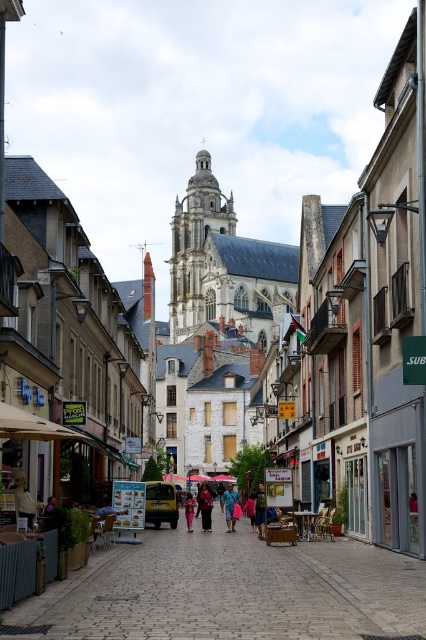
How far apart are black fabric bag at center and white fabric umbrella at center?

black fabric bag at center is 12.96 meters from white fabric umbrella at center.

Between black fabric bag at center and white fabric umbrella at center, which one is positioned higher?

Positioned higher is black fabric bag at center.

Describe the element at coordinates (204, 506) in the screenshot. I see `black fabric bag at center` at that location.

The height and width of the screenshot is (640, 426). Identify the location of black fabric bag at center. (204, 506).

Is point (206, 490) farther from viewer compared to point (187, 513)?

Yes, it is behind point (187, 513).

Can you confirm if black fabric bag at center is bigger than dark blue jeans at center?

Correct, black fabric bag at center is larger in size than dark blue jeans at center.

Between point (198, 493) and point (187, 531), which one is positioned in front?

Point (187, 531) is in front.

At what (x,y) coordinates should I click in order to perform the action: click on black fabric bag at center. Please return your answer as a coordinate pair (x, y). Image resolution: width=426 pixels, height=640 pixels. Looking at the image, I should click on (204, 506).

The width and height of the screenshot is (426, 640). What do you see at coordinates (230, 592) in the screenshot?
I see `smooth stone pavement at center` at bounding box center [230, 592].

Locate an element on the screen. smooth stone pavement at center is located at coordinates (230, 592).